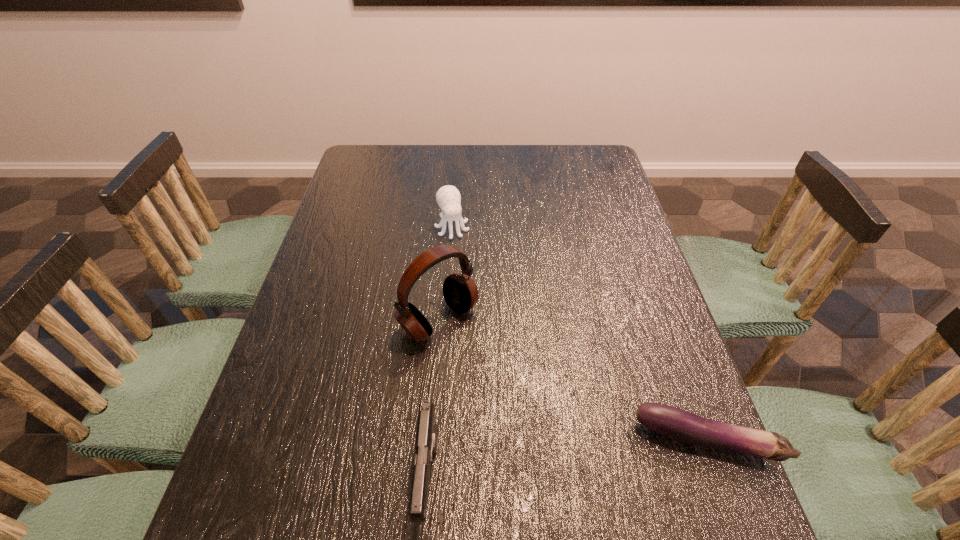
The image size is (960, 540). I want to click on vacant space on the desktop that is between the pistol and the rightmost object and is positioned on the ear pads of the third nearest object, so click(x=584, y=458).

Where is `free space on the desktop that is between the pistol and the eggplant and is positioned on the front-facing side of the octopus`? The width and height of the screenshot is (960, 540). free space on the desktop that is between the pistol and the eggplant and is positioned on the front-facing side of the octopus is located at coordinates (540, 464).